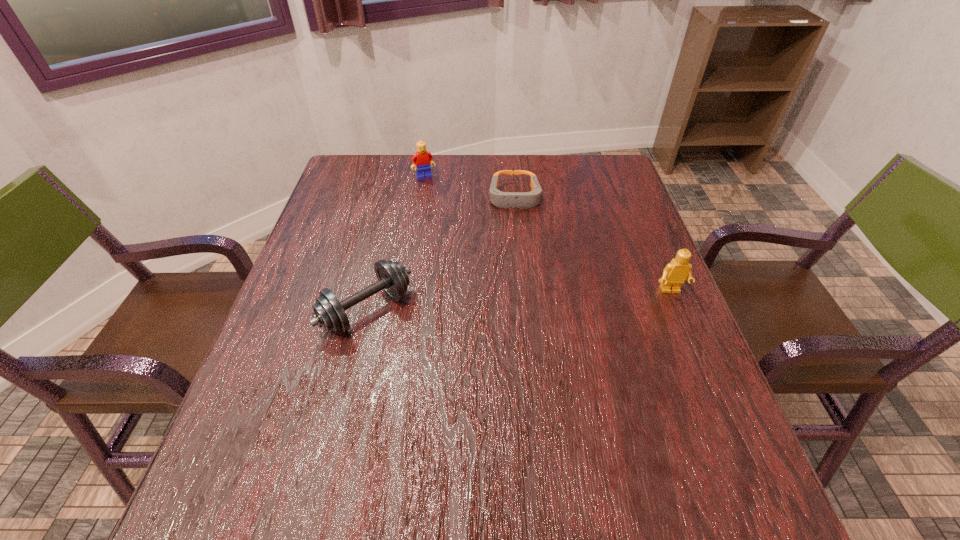
At what (x,y) coordinates should I click in order to perform the action: click on free space on the desktop that is between the dumbbell and the rightmost object and is positioned on the front and back of the third nearest object. Please return your answer as a coordinate pair (x, y). This screenshot has height=540, width=960. Looking at the image, I should click on (523, 300).

Where is `vacant space on the desktop that is between the dumbbell and the right Lego and is positioned on the face of the left Lego`? The height and width of the screenshot is (540, 960). vacant space on the desktop that is between the dumbbell and the right Lego and is positioned on the face of the left Lego is located at coordinates (487, 302).